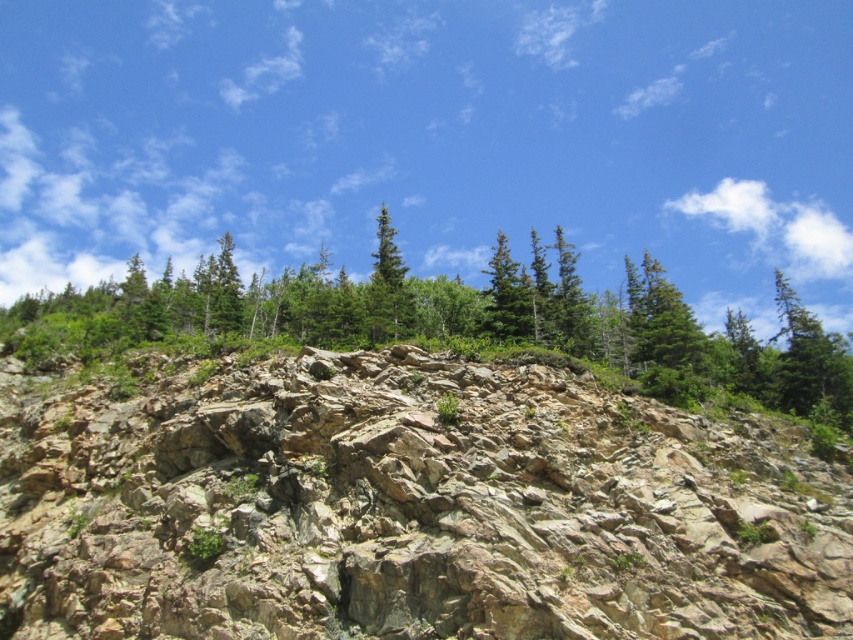
You are a hiker planning to cross the rocky terrain at center and the green textured trees at upper center. Which area would require more caution due to its smaller size and potentially unstable footing?

The rocky terrain at center requires more caution because it has a smaller size compared to the green textured trees at upper center, making it less stable underfoot.